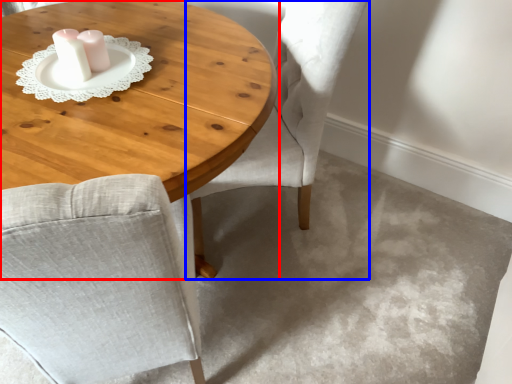
Question: Which object is closer to the camera taking this photo, coffee table (highlighted by a red box) or chair (highlighted by a blue box)?

Choices:
 (A) coffee table
 (B) chair

Answer: (A)